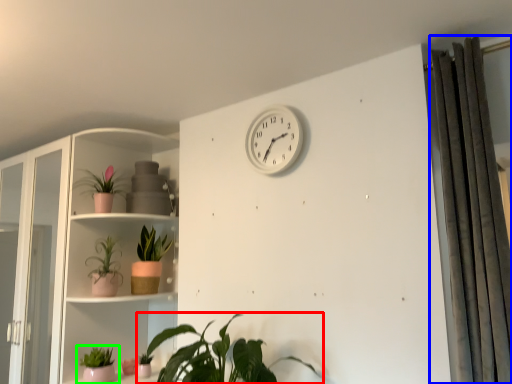
Question: Estimate the real-world distances between objects in this image. Which object is farther from houseplant (highlighted by a red box), curtain (highlighted by a blue box) or houseplant (highlighted by a green box)?

Choices:
 (A) curtain
 (B) houseplant

Answer: (A)